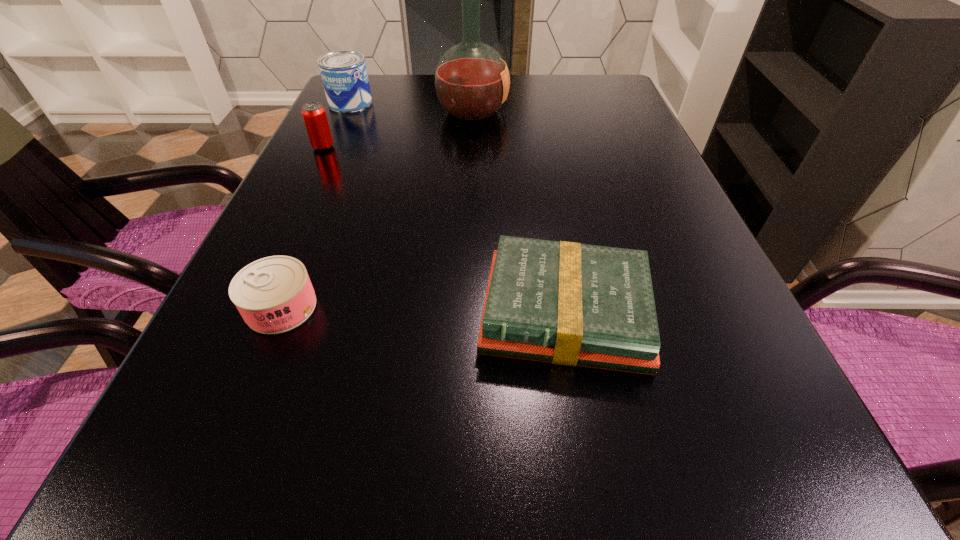
This screenshot has width=960, height=540. Find the location of `vacant region located 0.250m on the right of the shortest can`. vacant region located 0.250m on the right of the shortest can is located at coordinates (471, 307).

The width and height of the screenshot is (960, 540). I want to click on liquor that is at the far edge, so click(x=471, y=80).

This screenshot has width=960, height=540. Find the location of `can at the far edge`. can at the far edge is located at coordinates point(344,75).

Where is `object that is at the right edge`? The image size is (960, 540). object that is at the right edge is located at coordinates (566, 303).

Locate an element on the screen. The height and width of the screenshot is (540, 960). object that is at the far left corner is located at coordinates (344, 75).

Find the location of a particular element. free space at the far edge of the desktop is located at coordinates (514, 110).

This screenshot has width=960, height=540. Identify the location of free location at the near edge of the desktop. (654, 496).

At what (x,y) coordinates should I click in order to perform the action: click on free space at the left edge of the desktop. Please return your answer as a coordinate pair (x, y). The width and height of the screenshot is (960, 540). Looking at the image, I should click on (303, 219).

Identify the location of free spot at the right edge of the desktop. The image size is (960, 540). (737, 441).

Where is `free location at the far left corner of the desktop`? The image size is (960, 540). free location at the far left corner of the desktop is located at coordinates (383, 104).